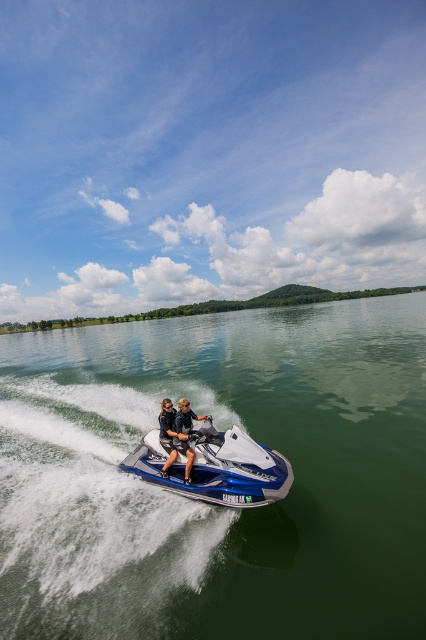
You are a photographer trying to capture a clear shot of the blue metallic jet ski at center and the black matte wetsuits at center. Based on their positions, which object should you focus on first to ensure both are in frame?

The blue metallic jet ski at center is below the black matte wetsuits at center, so you should focus on the black matte wetsuits at center first to ensure both are in frame.

You are a photographer trying to capture the height difference between the blue metallic water at center and the blue metallic jet ski at center. Based on the scene, which object appears taller in the image?

The blue metallic water at center appears taller than the blue metallic jet ski at center in the image.